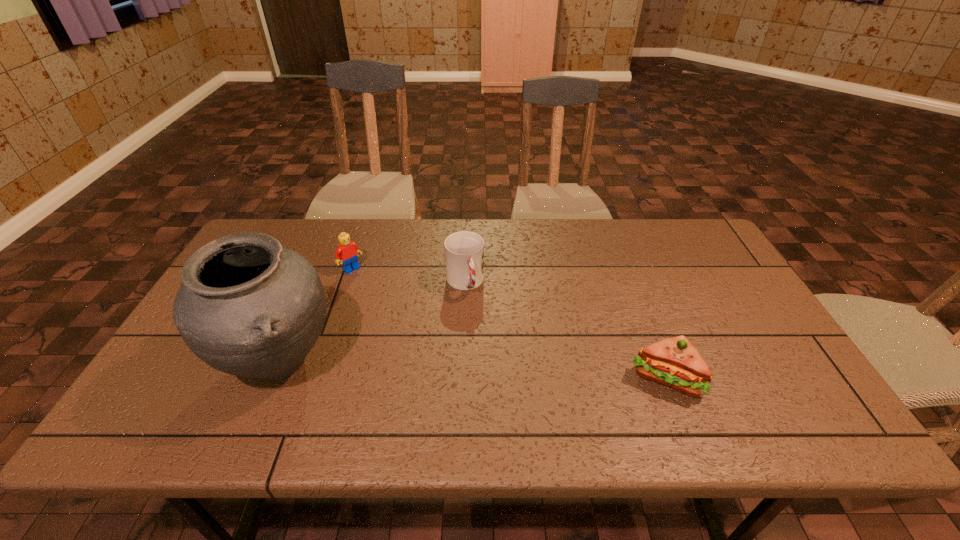
I want to click on free space at the right edge of the desktop, so click(679, 265).

This screenshot has width=960, height=540. I want to click on free space at the far left corner of the desktop, so 285,235.

Where is `vacant space at the near left corner`? This screenshot has width=960, height=540. vacant space at the near left corner is located at coordinates (160, 373).

In the image, there is a desktop. At what (x,y) coordinates should I click in order to perform the action: click on free space at the far right corner. Please return your answer as a coordinate pair (x, y). Looking at the image, I should click on (669, 246).

Identify the location of empty space that is in between the rightmost object and the second object from right to left. The image size is (960, 540). (565, 330).

Identify the location of unoccupied position between the second object from right to left and the urn. (372, 322).

Image resolution: width=960 pixels, height=540 pixels. In order to click on vacant area that lies between the sandwich and the urn in this screenshot , I will do `click(473, 370)`.

Locate an element on the screen. This screenshot has height=540, width=960. empty space between the sandwich and the cup is located at coordinates (565, 330).

Identify the location of free space that is in between the urn and the rightmost object. (473, 370).

Image resolution: width=960 pixels, height=540 pixels. I want to click on free space between the sandwich and the Lego, so click(x=509, y=323).